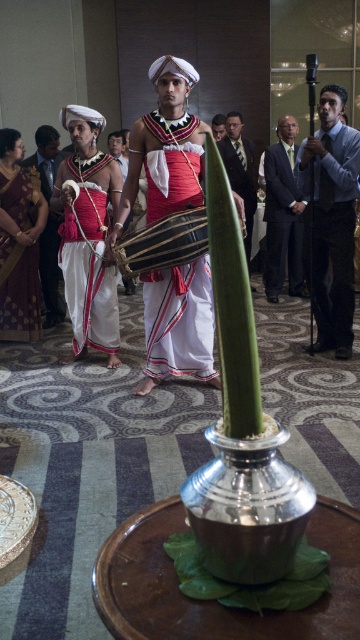
Question: Is smooth black suit at center to the right of matte white shirt at center from the viewer's perspective?

Choices:
 (A) yes
 (B) no

Answer: (A)

Question: Does maroon silk saree at left appear on the left side of dark gray suit at center?

Choices:
 (A) yes
 (B) no

Answer: (A)

Question: Among these objects, which one is nearest to the camera?

Choices:
 (A) striped drum at center
 (B) maroon silk saree at left
 (C) red and white fabric drum at center
 (D) dark gray suit at center

Answer: (A)

Question: Which object is positioned closest to the matte red cloth at left?

Choices:
 (A) dark blue shirt at right
 (B) red and white fabric drum at center
 (C) dark gray suit at center
 (D) matte white shirt at center

Answer: (B)

Question: Which of these objects is positioned closest to the maroon silk saree at left?

Choices:
 (A) white silk sari at left
 (B) matte white shirt at center
 (C) smooth black suit at center

Answer: (A)

Question: Where is white silk sari at left located in relation to matte white shirt at center in the image?

Choices:
 (A) below
 (B) above

Answer: (A)